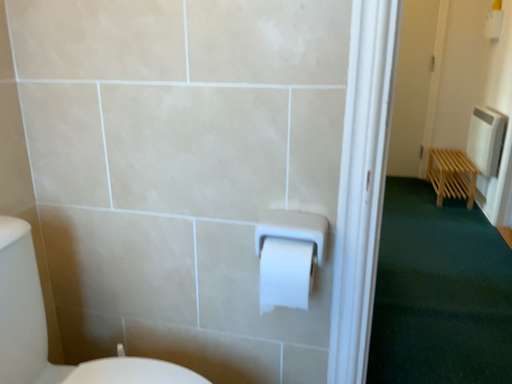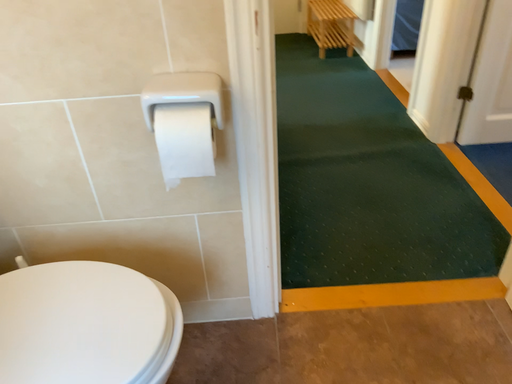
Question: Which way did the camera rotate in the video?

Choices:
 (A) rotated upward
 (B) rotated downward

Answer: (B)